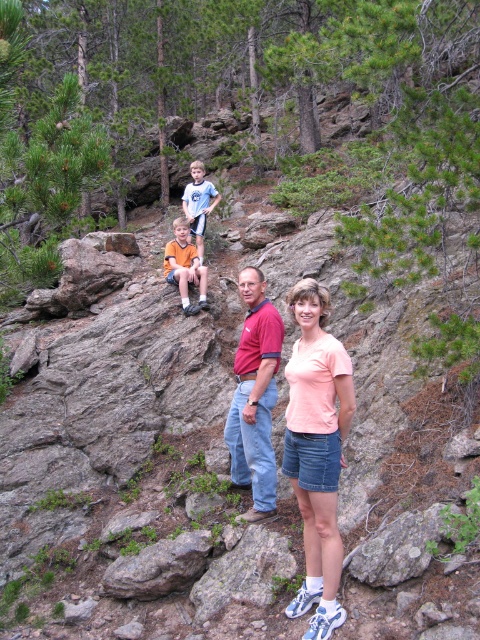
Question: Does pink cotton t-shirt at center have a larger size compared to light blue t-shirt at center?

Choices:
 (A) no
 (B) yes

Answer: (A)

Question: Which is farther from the light blue t-shirt at center?

Choices:
 (A) orange cotton shirt at center
 (B) pink cotton t-shirt at center

Answer: (B)

Question: Is pink cotton t-shirt at center smaller than light blue t-shirt at center?

Choices:
 (A) yes
 (B) no

Answer: (A)

Question: From the image, what is the correct spatial relationship of pink cotton t-shirt at center in relation to light blue t-shirt at center?

Choices:
 (A) left
 (B) right

Answer: (B)

Question: Based on their relative distances, which object is nearer to the light blue t-shirt at center?

Choices:
 (A) pink cotton t-shirt at center
 (B) red cotton polo shirt at center

Answer: (B)

Question: Among these objects, which one is nearest to the camera?

Choices:
 (A) orange cotton shirt at center
 (B) red cotton polo shirt at center
 (C) light blue t-shirt at center
 (D) pink cotton t-shirt at center

Answer: (D)